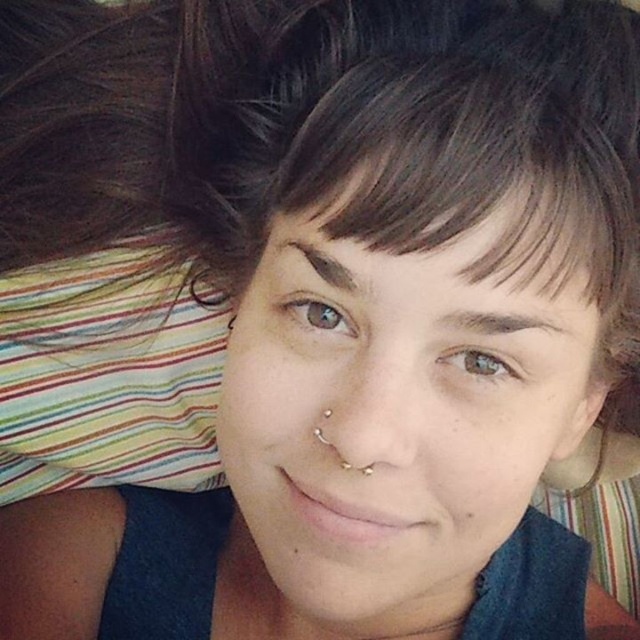
You are a photographer adjusting your camera to focus on the person in the image. The focus point is set to the point at the center of the face, which is at coordinates point (390, 417). If you want to ensure the nose piercing with multiple rings is in focus, should you adjust the focus point towards the top or bottom of the face?

The nose piercing with multiple rings is located on the smooth skin face at center represented by point (390, 417). Since the piercing is part of the face, the existing focus point at point (390, 417) should already capture it in focus. No adjustment is needed.

You are a photographer setting up a portrait shoot. You need to ensure that the subject has enough space between their face and hair to avoid a cluttered look. Given the smooth skin face at center and brown matte hair at center, which one requires more space in the frame?

The smooth skin face at center requires more space in the frame because its width is larger than the brown matte hair at center.

You are a photographer trying to capture the perfect shot of the smooth skin face at center and the brown matte hair at center. Based on their sizes in the image, which one should you focus on to ensure it fills the frame more?

The smooth skin face at center is taller than the brown matte hair at center, so focusing on the smooth skin face at center will ensure it fills the frame more.